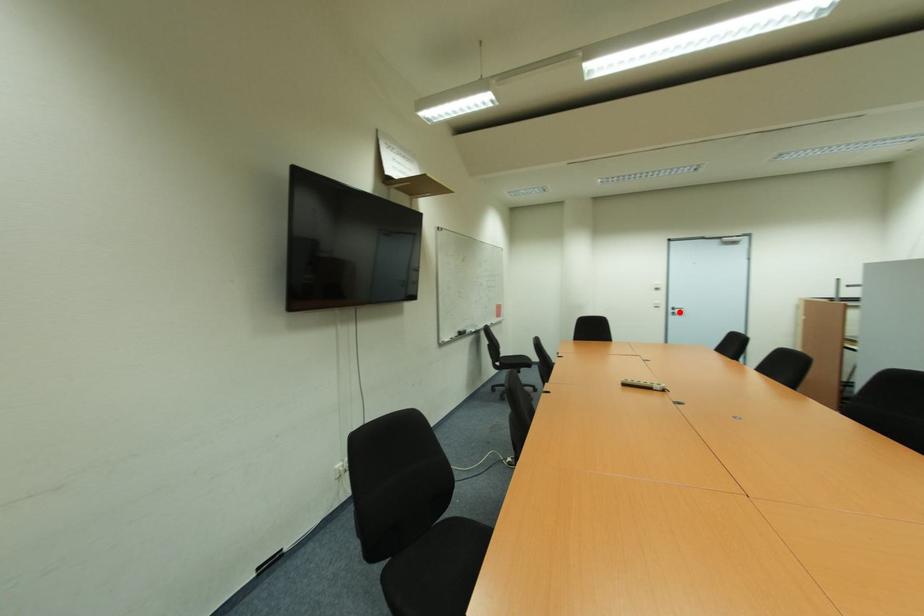
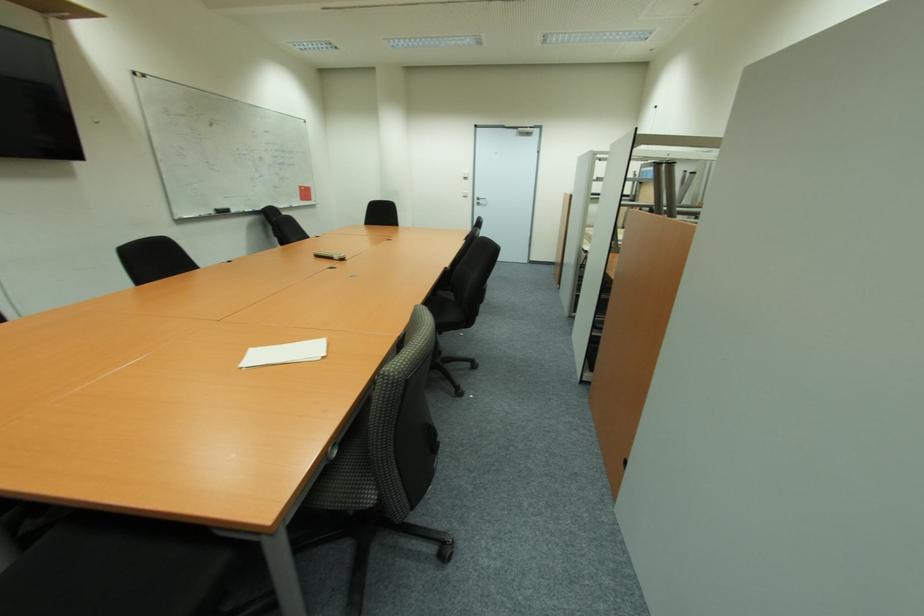
Question: I am providing you with two images of the same scene from different viewpoints. A red point is shown in image1. For the corresponding object point in image2, is it positioned nearer or farther from the camera?

Choices:
 (A) Nearer
 (B) Farther

Answer: (A)